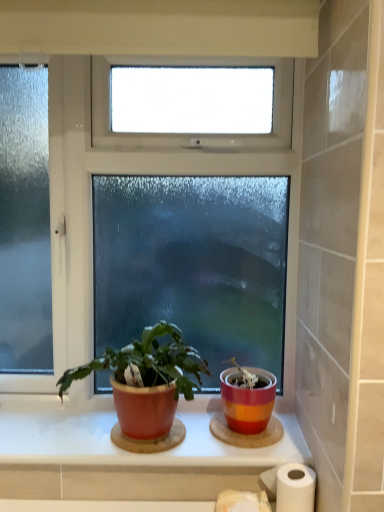
At what (x,y) coordinates should I click in order to perform the action: click on vacant point above matte ceramic window sill at center (from a real-world perspective). Please return your answer as a coordinate pair (x, y). This screenshot has height=512, width=384. Looking at the image, I should click on (116, 431).